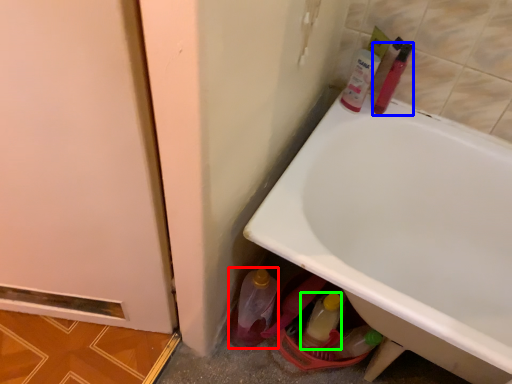
Question: Estimate the real-world distances between objects in this image. Which object is closer to bottle (highlighted by a red box), mouthwash (highlighted by a blue box) or bottle (highlighted by a green box)?

Choices:
 (A) mouthwash
 (B) bottle

Answer: (B)